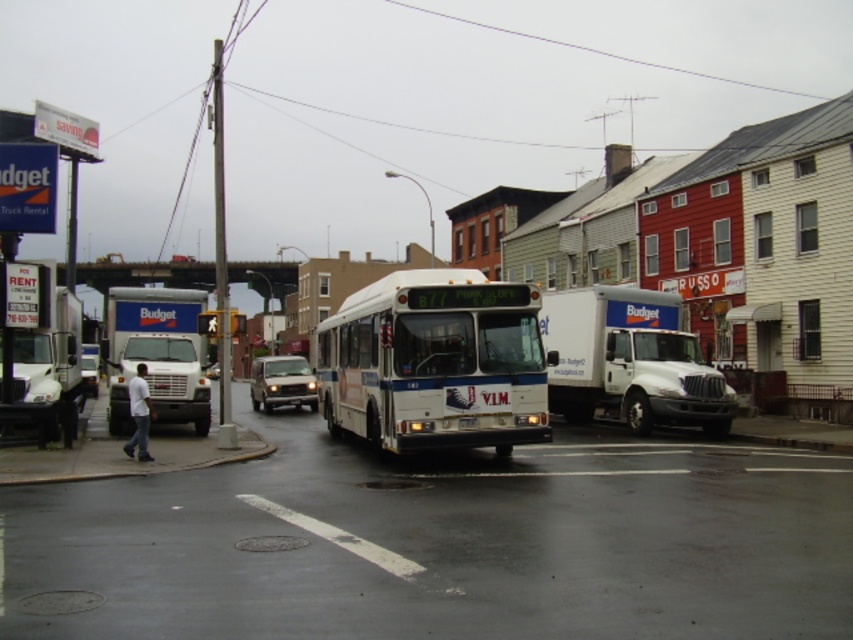
You are a pedestrian standing on the sidewalk and want to cross the street to read the white plastic sign at upper left. The white glossy bus at center is blocking your view. Can you walk around the bus to get a clear view of the sign?

The white glossy bus at center is larger than the white plastic sign at upper left, so if the bus is blocking your view, you might need to move further away from the bus to see the sign clearly.